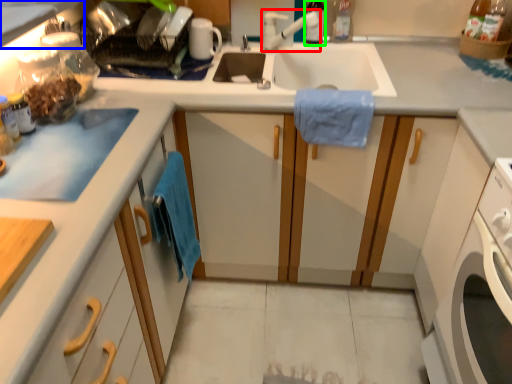
Question: Which is nearer to the faucet (highlighted by a red box)? countertop (highlighted by a blue box) or bottle (highlighted by a green box).

Choices:
 (A) countertop
 (B) bottle

Answer: (B)